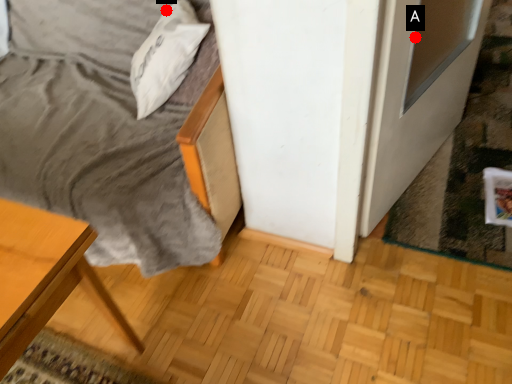
Question: Two points are circled on the image, labeled by A and B beside each circle. Which of the following is the closest to the observer?

Choices:
 (A) A is closer
 (B) B is closer

Answer: (A)